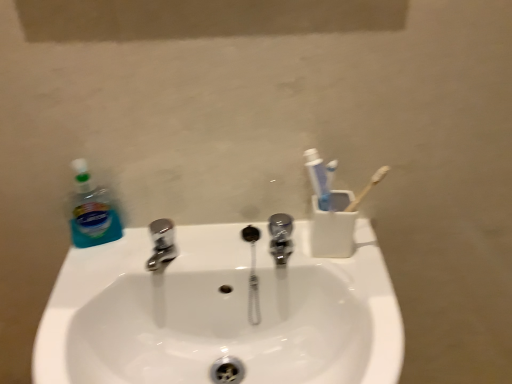
You are a GUI agent. You are given a task and a screenshot of the screen. Output one action in this format:
    pyautogui.click(x=<x>, y=<y>)
    Task: Click on the free space to the left of polished chrome tap at center
    Image resolution: width=512 pixels, height=384 pixels.
    Given the screenshot: What is the action you would take?
    pyautogui.click(x=197, y=248)